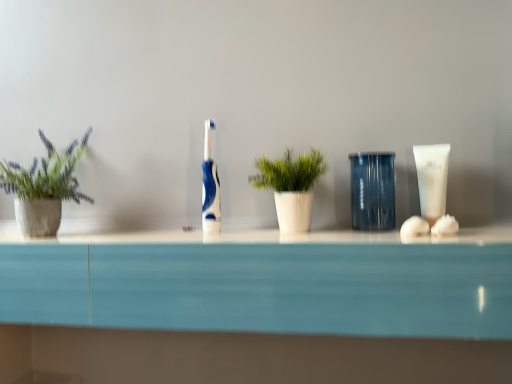
Question: In terms of width, does blue glossy toothbrush at center look wider or thinner when compared to white matte tube at right?

Choices:
 (A) wide
 (B) thin

Answer: (A)

Question: Is point (204, 198) closer or farther from the camera than point (420, 152)?

Choices:
 (A) closer
 (B) farther

Answer: (B)

Question: Considering the real-world distances, which object is farthest from the green leafy plant in concrete pot at left, positioned as the 2th houseplant in right-to-left order?

Choices:
 (A) blue glossy toothbrush at center
 (B) transparent plastic cup at center
 (C) white matte tube at right
 (D) green glossy plant at center, arranged as the 2th houseplant when viewed from the left

Answer: (C)

Question: Considering the real-world distances, which object is farthest from the green glossy plant at center, arranged as the 2th houseplant when viewed from the left?

Choices:
 (A) green leafy plant in concrete pot at left, positioned as the 2th houseplant in right-to-left order
 (B) blue glossy toothbrush at center
 (C) white matte tube at right
 (D) transparent plastic cup at center

Answer: (A)